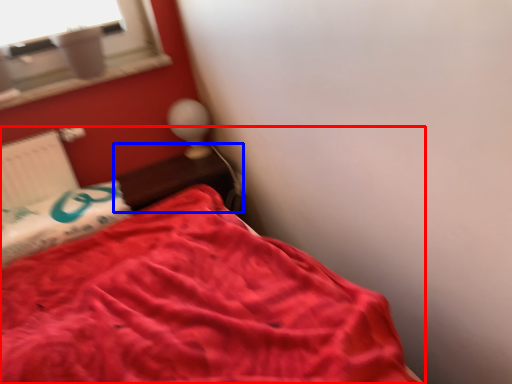
Question: Which object appears farthest to the camera in this image, bed (highlighted by a red box) or table (highlighted by a blue box)?

Choices:
 (A) bed
 (B) table

Answer: (B)